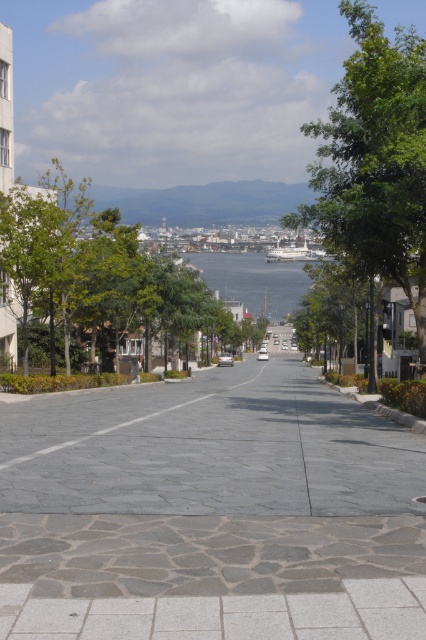
You are standing on the light beige sidewalk in the foreground of the urban street scene. You want to walk towards the gray stone pavement at center marked by point (210, 513). Which direction should you head?

You should head towards the center where the gray stone pavement is marked by point (210, 513), as the point indicates the location of the gray stone pavement at center.

You are standing on the sidewalk and notice the gray stone pavement at center and the green leafy tree at center. Which object is positioned to the right of the other?

The gray stone pavement at center is to the right of the green leafy tree at center.